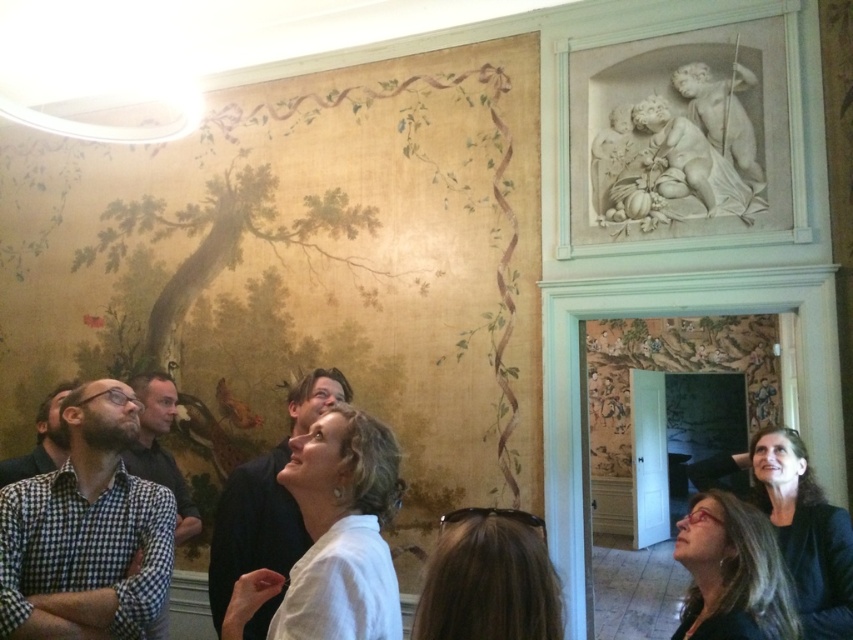
Between matte black jacket at lower right and checkered shirt at center, which one appears on the right side from the viewer's perspective?

matte black jacket at lower right

Looking at this image, who is taller, matte black jacket at lower right or checkered shirt at center?

With more height is checkered shirt at center.

Where is `matte black jacket at lower right`? The height and width of the screenshot is (640, 853). matte black jacket at lower right is located at coordinates (804, 531).

Locate an element on the screen. The image size is (853, 640). matte black jacket at lower right is located at coordinates (804, 531).

Between point (323, 500) and point (50, 444), which one is positioned in front?

Point (323, 500) is in front.

At what (x,y) coordinates should I click in order to perform the action: click on white matte shirt at center. Please return your answer as a coordinate pair (x, y). The image size is (853, 640). Looking at the image, I should click on (341, 531).

Find the location of `white matte shirt at center`. white matte shirt at center is located at coordinates (341, 531).

Is checkered shirt at left thinner than matte black jacket at lower right?

Yes, checkered shirt at left is thinner than matte black jacket at lower right.

In order to click on checkered shirt at left in this screenshot , I will do `click(86, 531)`.

What are the coordinates of `checkered shirt at left` in the screenshot? It's located at (86, 531).